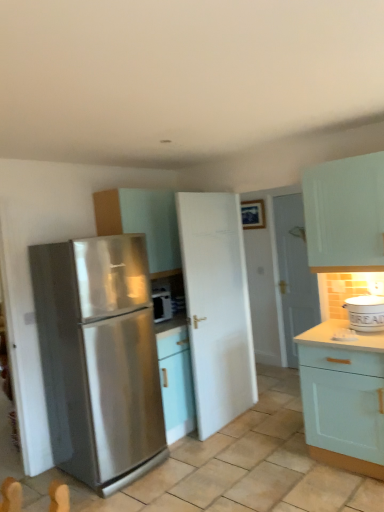
Where is `free area in between stainless steel refrigerator at left and light teal wood cabinet at lower right, marked as the first cabinetry in a front-to-back arrangement`? The width and height of the screenshot is (384, 512). free area in between stainless steel refrigerator at left and light teal wood cabinet at lower right, marked as the first cabinetry in a front-to-back arrangement is located at coordinates (236, 472).